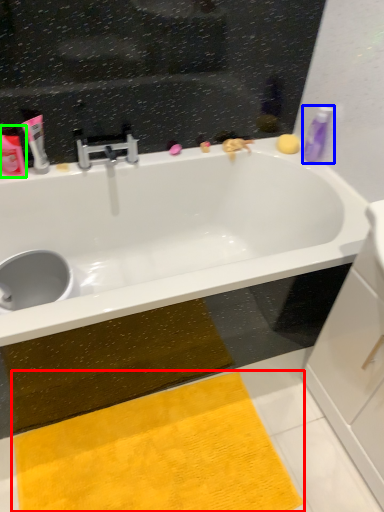
Question: Considering the real-world distances, which object is farthest from doormat (highlighted by a red box)? toiletry (highlighted by a blue box) or toiletry (highlighted by a green box)?

Choices:
 (A) toiletry
 (B) toiletry

Answer: (A)